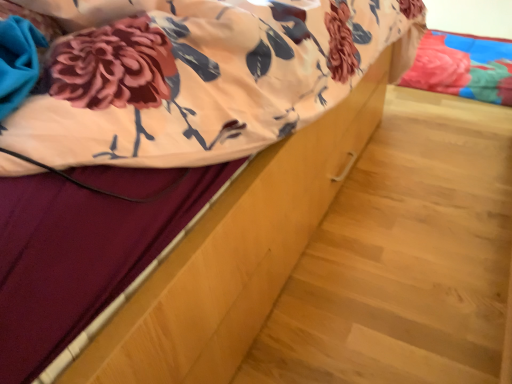
This screenshot has height=384, width=512. What do you see at coordinates (463, 67) in the screenshot? I see `velvet floral pillow at upper right` at bounding box center [463, 67].

The image size is (512, 384). In order to click on velvet floral pillow at upper right in this screenshot , I will do `click(463, 67)`.

Measure the distance between point [440,70] and camera.

A distance of 6.36 feet exists between point [440,70] and camera.

Locate an element on the screen. This screenshot has height=384, width=512. velvet floral pillow at upper right is located at coordinates (463, 67).